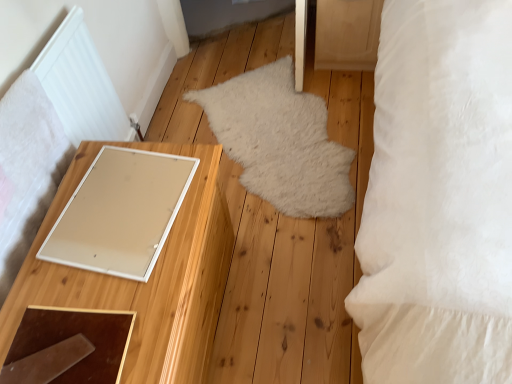
Where is `empty space that is ontop of white glossy board at left (from a real-world perspective)`? This screenshot has height=384, width=512. empty space that is ontop of white glossy board at left (from a real-world perspective) is located at coordinates (118, 195).